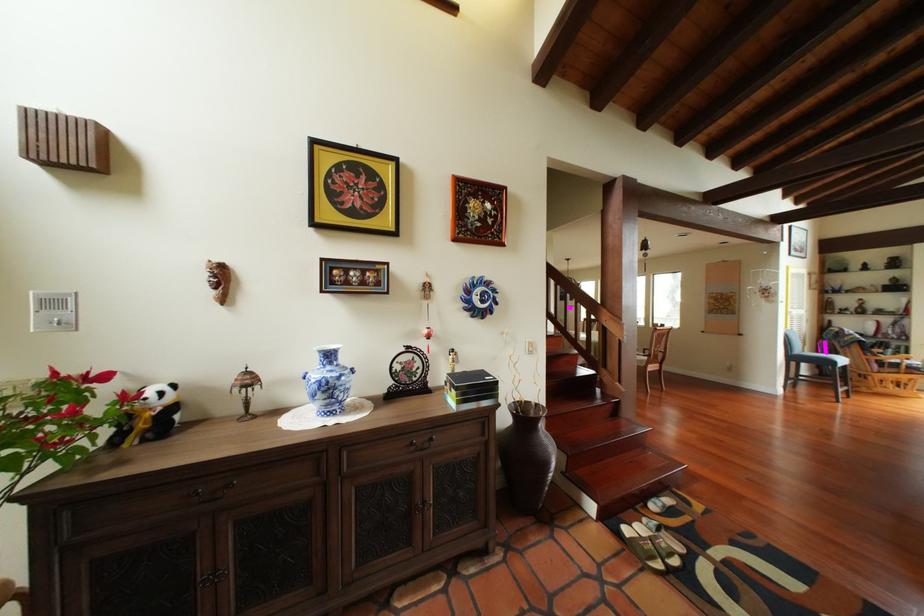
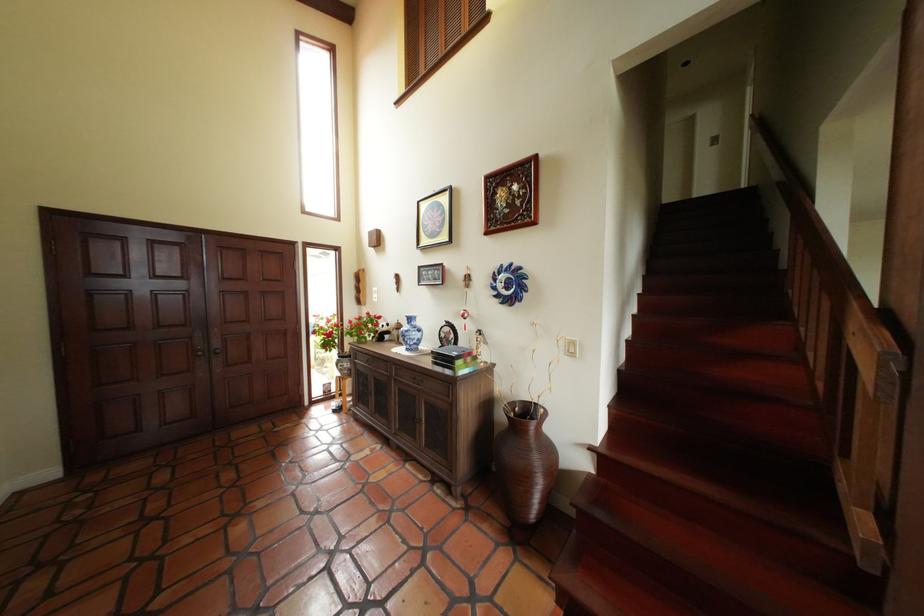
The point at (347,391) is marked in the first image. Where is the corresponding point in the second image?

(418, 338)